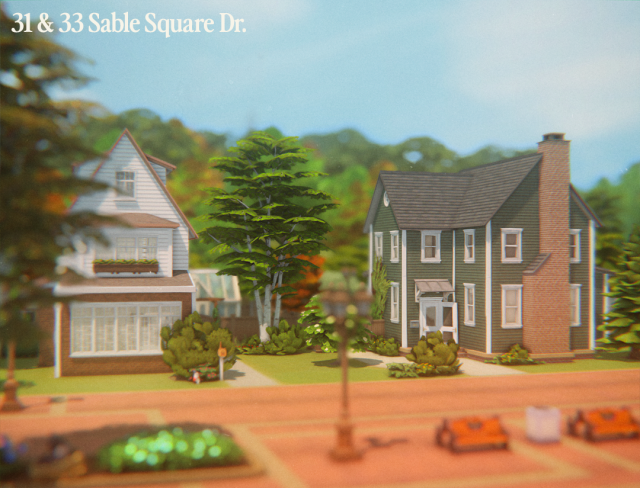
The image size is (640, 488). Identify the location of window planter. (132, 267), (105, 267), (152, 267).